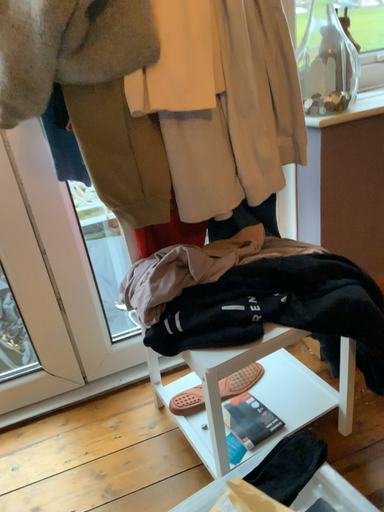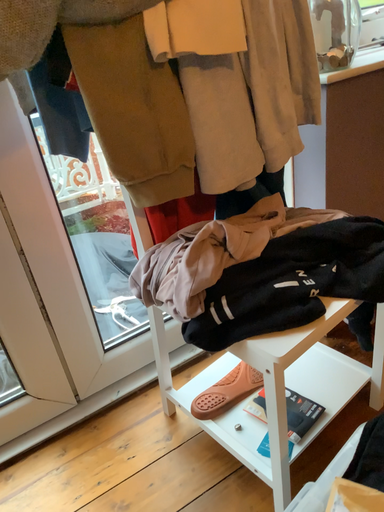
Question: How did the camera likely rotate when shooting the video?

Choices:
 (A) rotated left
 (B) rotated right

Answer: (B)